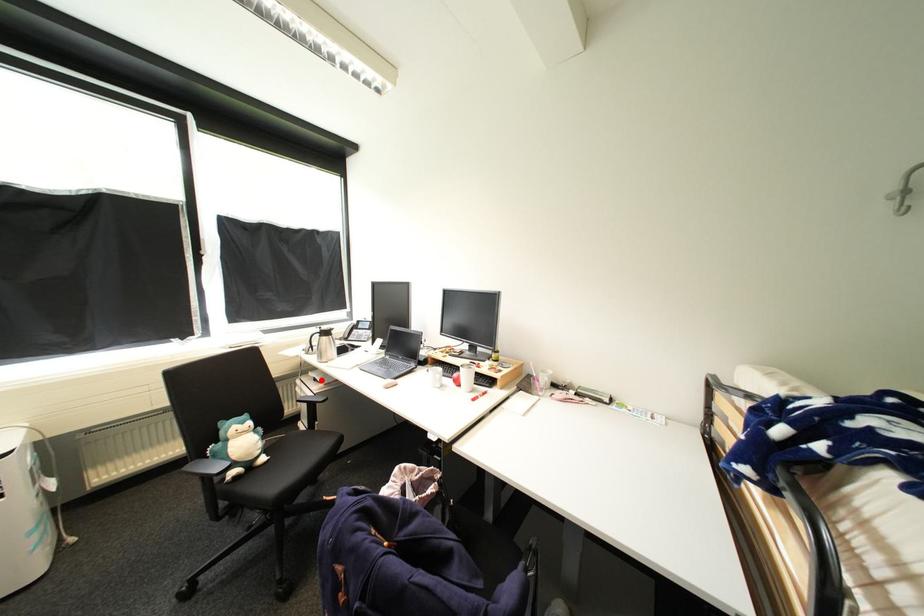
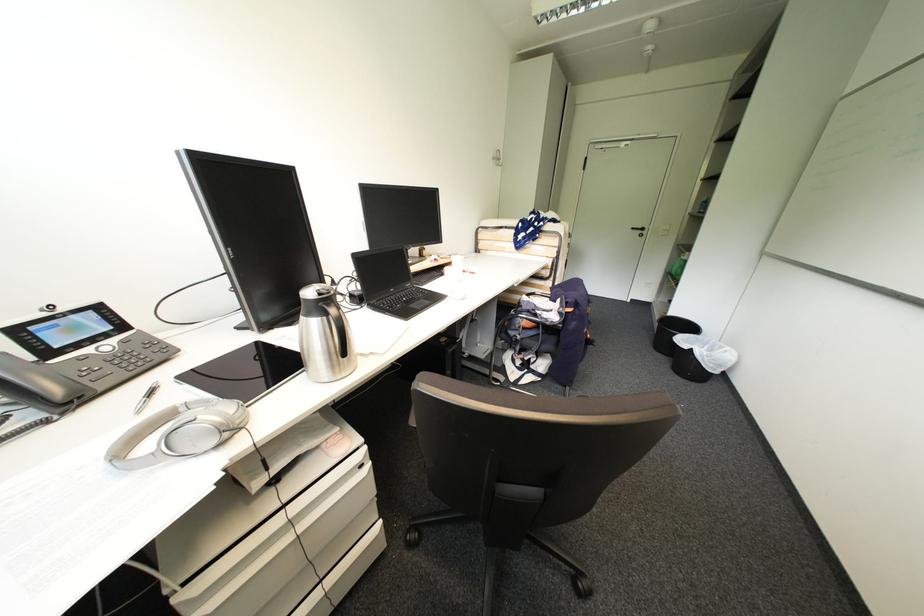
Locate, in the second image, the point that corresponds to the highlighted location in the first image.

(283, 480)